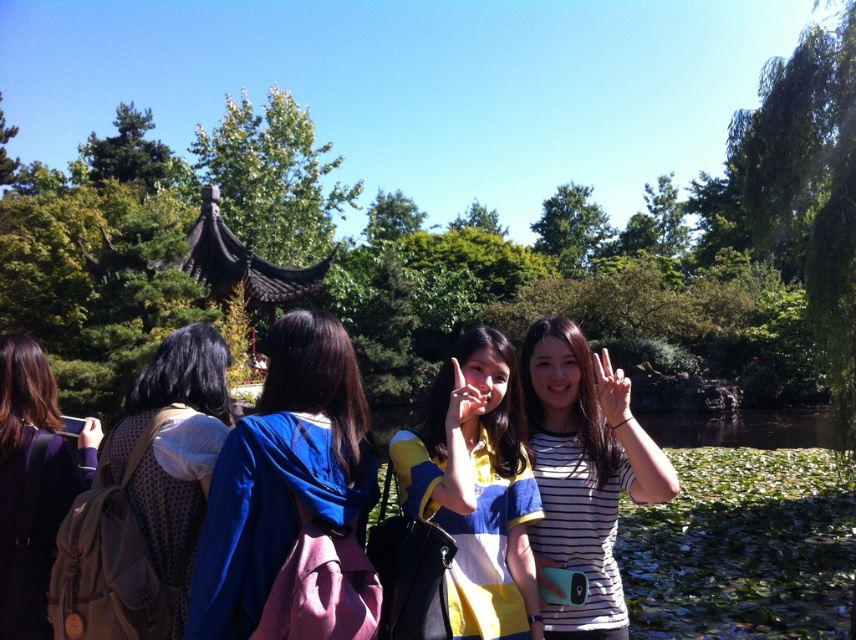
Question: Is blue fabric jacket at center further to camera compared to dark purple hoodie at center?

Choices:
 (A) yes
 (B) no

Answer: (B)

Question: Which object is the closest to the brown textured backpack at left?

Choices:
 (A) dark purple hoodie at center
 (B) blue fabric jacket at center

Answer: (B)

Question: Is yellow striped shirt at center wider than brown textured backpack at left?

Choices:
 (A) no
 (B) yes

Answer: (A)

Question: Among these objects, which one is farthest from the camera?

Choices:
 (A) white matte hand at center
 (B) white striped shirt at center
 (C) matte brown backpack at lower left

Answer: (C)

Question: Can you confirm if yellow striped shirt at center is positioned above brown textured backpack at left?

Choices:
 (A) no
 (B) yes

Answer: (B)

Question: Which object appears closest to the camera in this image?

Choices:
 (A) white matte hand at center
 (B) brown textured backpack at left

Answer: (B)